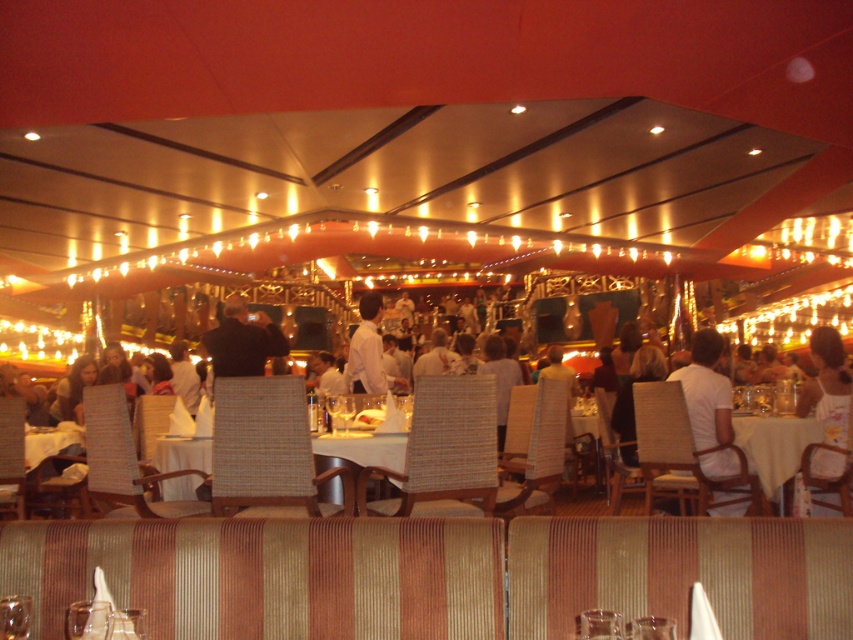
You are a waiter in the dining area and need to deliver a tray to the table closest to you. The tables are located at point (828, 452) and point (370, 323). Which table should you go to?

You should go to the table at point (828, 452) because it is closer to you than the table at point (370, 323).

You are a waiter in the dining area and need to deliver a drink to the table. You see the white matte shirt at center and the yellow fabric table at center. Which object is closer to the left side of the scene?

The white matte shirt at center is to the left of the yellow fabric table at center, so it is closer to the left side of the scene.